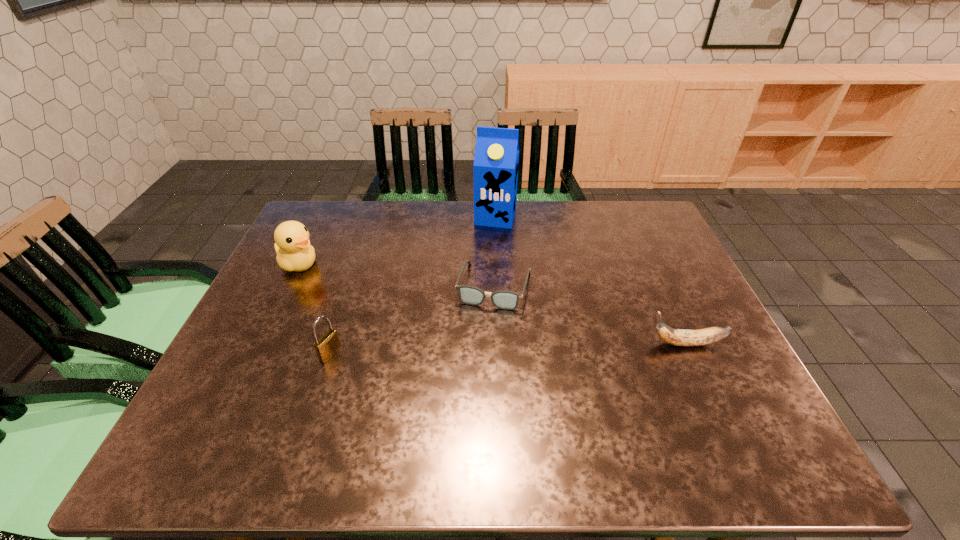
Image resolution: width=960 pixels, height=540 pixels. I want to click on unoccupied area between the spectacles and the tallest object, so click(x=495, y=251).

Locate an element on the screen. The image size is (960, 540). empty space that is in between the farthest object and the rightmost object is located at coordinates (591, 280).

Choose which object is the nearest neighbor to the fourth object from right to left. Please provide its 2D coordinates. Your answer should be formatted as a tuple, i.e. [(x, y)], where the tuple contains the x and y coordinates of a point satisfying the conditions above.

[(292, 245)]

The image size is (960, 540). I want to click on object that can be found as the third closest to the tallest object, so click(x=680, y=337).

Where is `vacant position in the image that satisfies the following two spatial constraints: 1. on the front side of the duck; 2. on the right side of the shortest object`? The height and width of the screenshot is (540, 960). vacant position in the image that satisfies the following two spatial constraints: 1. on the front side of the duck; 2. on the right side of the shortest object is located at coordinates (288, 286).

The width and height of the screenshot is (960, 540). Find the location of `free spot that satisfies the following two spatial constraints: 1. on the front side of the carton; 2. on the peel of the banana`. free spot that satisfies the following two spatial constraints: 1. on the front side of the carton; 2. on the peel of the banana is located at coordinates (501, 343).